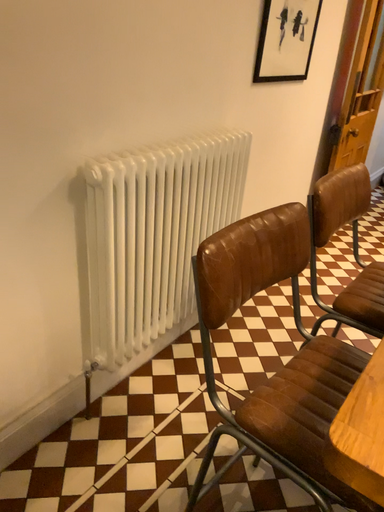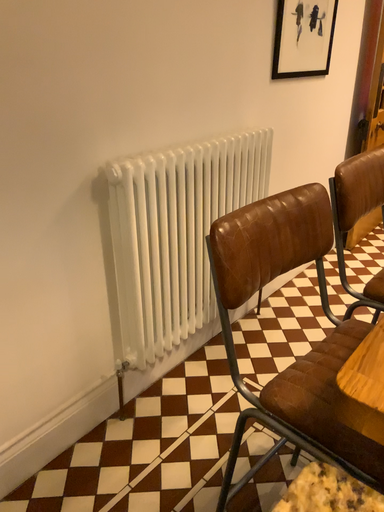
Question: How did the camera likely rotate when shooting the video?

Choices:
 (A) rotated right
 (B) rotated left

Answer: (B)